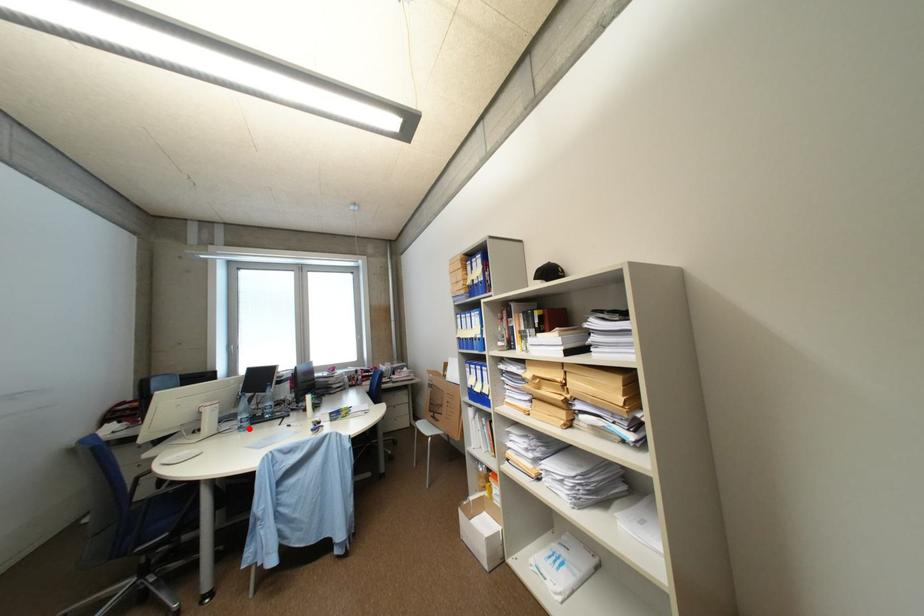
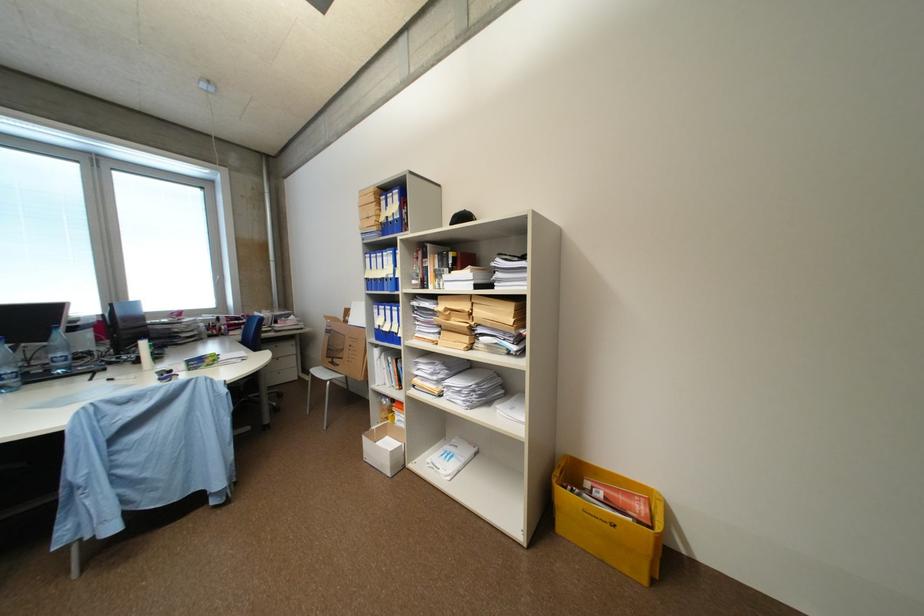
In the second image, find the point that corresponds to the highlighted location in the first image.

(10, 389)